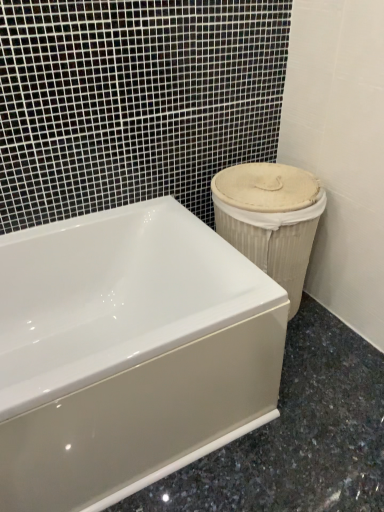
Question: Is white glossy bathtub at center inside the boundaries of beige woven basket at right, or outside?

Choices:
 (A) outside
 (B) inside

Answer: (A)

Question: Considering the relative positions of white glossy bathtub at center and beige woven basket at right in the image provided, is white glossy bathtub at center to the left or to the right of beige woven basket at right?

Choices:
 (A) right
 (B) left

Answer: (B)

Question: From the image's perspective, is white glossy bathtub at center above or below beige woven basket at right?

Choices:
 (A) above
 (B) below

Answer: (B)

Question: From a real-world perspective, is beige woven basket at right positioned above or below white glossy bathtub at center?

Choices:
 (A) below
 (B) above

Answer: (B)

Question: From the image's perspective, relative to white glossy bathtub at center, is beige woven basket at right above or below?

Choices:
 (A) below
 (B) above

Answer: (B)

Question: In terms of width, does beige woven basket at right look wider or thinner when compared to white glossy bathtub at center?

Choices:
 (A) thin
 (B) wide

Answer: (A)

Question: Considering the positions of beige woven basket at right and white glossy bathtub at center in the image, is beige woven basket at right bigger or smaller than white glossy bathtub at center?

Choices:
 (A) big
 (B) small

Answer: (B)